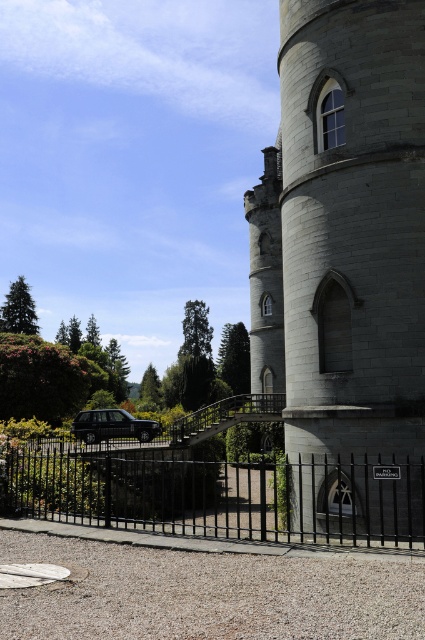
Is gray stone tower at center shorter than black wrought iron fence at lower center?

In fact, gray stone tower at center may be taller than black wrought iron fence at lower center.

Which of these two, gray stone tower at center or black wrought iron fence at lower center, stands shorter?

Standing shorter between the two is black wrought iron fence at lower center.

Does point (410, 212) lie in front of point (374, 531)?

No, (410, 212) is further to viewer.

Image resolution: width=425 pixels, height=640 pixels. I want to click on gray stone tower at center, so click(345, 260).